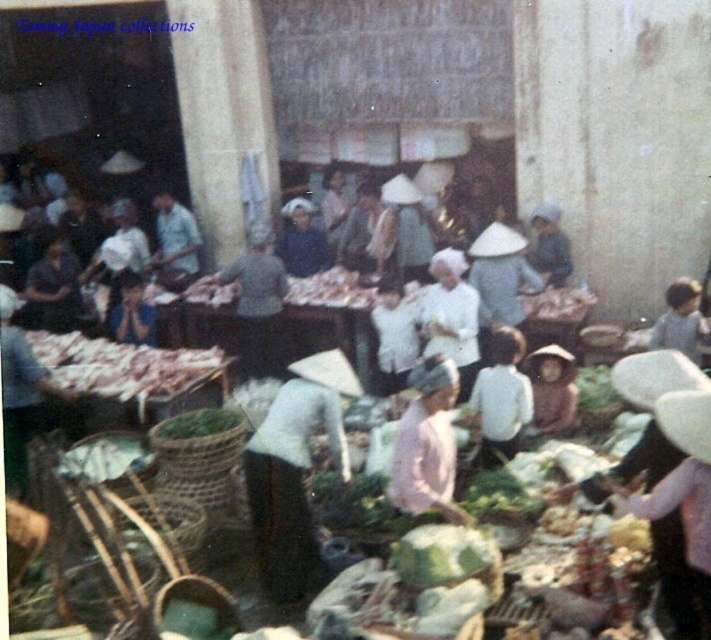
You are a vendor at the market and want to place a new item on the white fabric hat at center and the green woven basket at lower center. Which object is closer to you so you can reach it first?

The white fabric hat at center is closer to you than the green woven basket at lower center, so you can reach it first.

You are standing at point (294, 470) in the market scene. What object is located exactly at this point?

The white fabric hat at center is located exactly at point (294, 470).

You are standing at the entrance of the market and see the white matte child at center. If you want to reach the child, in which direction should you move relative to your current position?

The white matte child at center is located at coordinates 0.623 along the x axis and 0.706 along the y axis, so you should move towards the center of the market to reach them.